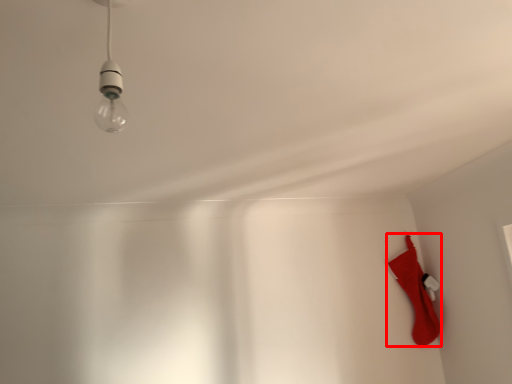
Question: From the image, what is the correct spatial relationship of sock (annotated by the red box) in relation to lamp?

Choices:
 (A) right
 (B) left

Answer: (A)